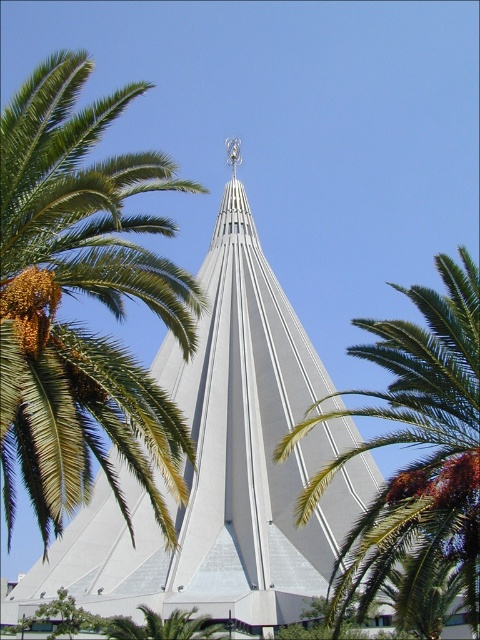
You are standing at the base of the tall conical tower and want to take a photo of the green leafy palm tree at upper left. If your camera has a maximum zoom range of 100 feet, will you be able to capture the palm tree clearly without moving closer?

The green leafy palm tree at upper left is 123.60 feet away from the camera. Since the camera can only zoom up to 100 feet, you won not be able to capture the palm tree clearly without moving closer.